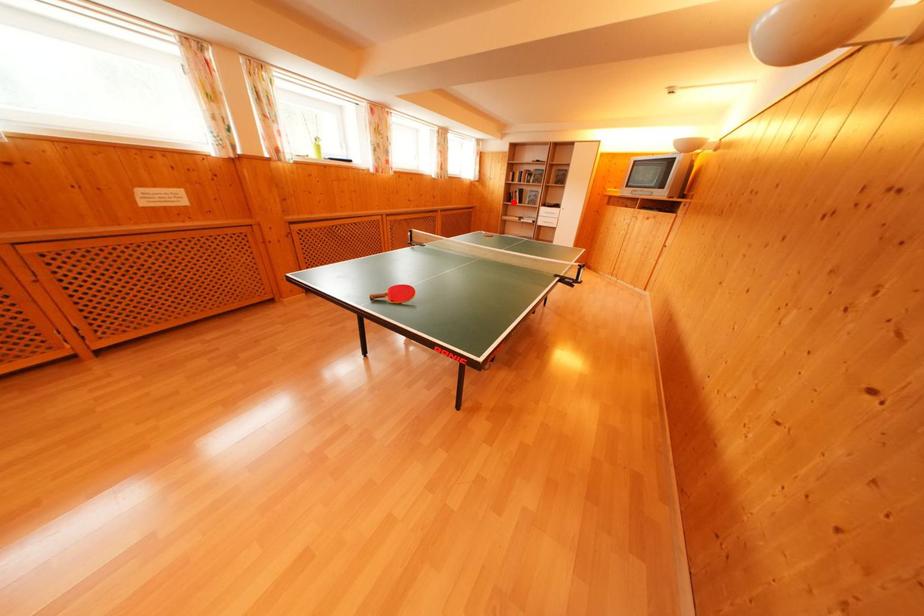
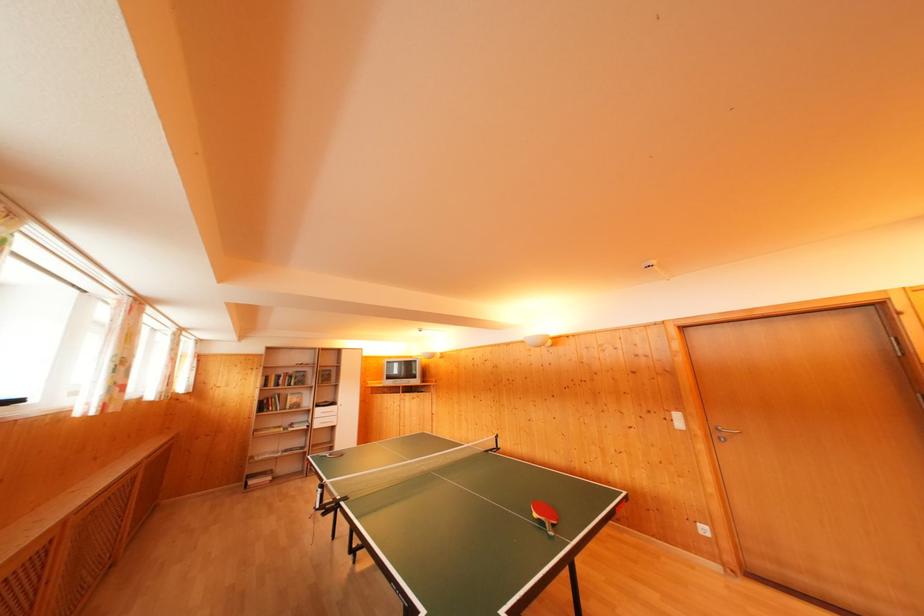
Question: I am providing you with two images of the same scene from different viewpoints. Image1 has a red point marked. In image2, the corresponding 3D location appears at what relative position? Reply with the corresponding letter.

Choices:
 (A) Closer
 (B) Farther

Answer: (B)